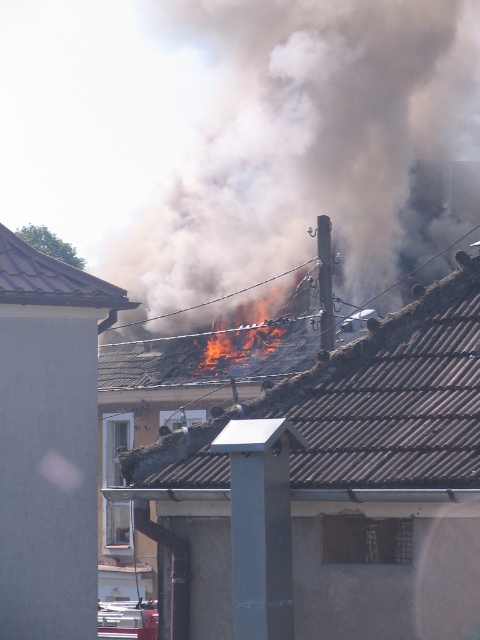
Can you confirm if smoke/dense at center is thinner than flaming wood at center?

In fact, smoke/dense at center might be wider than flaming wood at center.

Between point (380, 77) and point (268, 326), which one is positioned in front?

Point (268, 326) is more forward.

Locate an element on the screen. The width and height of the screenshot is (480, 640). smoke/dense at center is located at coordinates (x=304, y=141).

In the scene shown: Is brown tile roof at center shorter than flaming wood at center?

Yes.

Is brown tile roof at center wider than flaming wood at center?

Yes, brown tile roof at center is wider than flaming wood at center.

The width and height of the screenshot is (480, 640). In order to click on brown tile roof at center in this screenshot , I will do `click(393, 397)`.

Which is in front, point (23, 256) or point (247, 316)?

Point (23, 256) is in front.

Looking at this image, does metallic tile roof at upper left lie behind flaming wood at center?

That is False.

Does point (34, 275) lie behind point (232, 353)?

No.

Locate an element on the screen. The width and height of the screenshot is (480, 640). metallic tile roof at upper left is located at coordinates (50, 280).